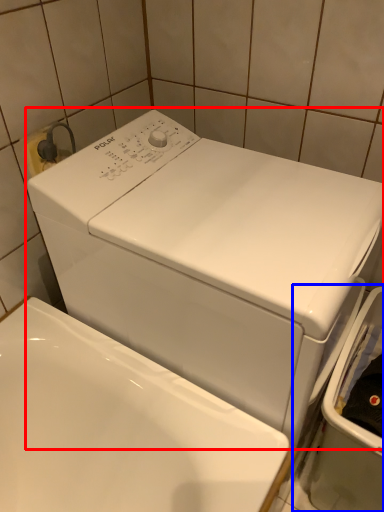
Question: Which object is further to the camera taking this photo, washing machine (highlighted by a red box) or dish washer (highlighted by a blue box)?

Choices:
 (A) washing machine
 (B) dish washer

Answer: (B)